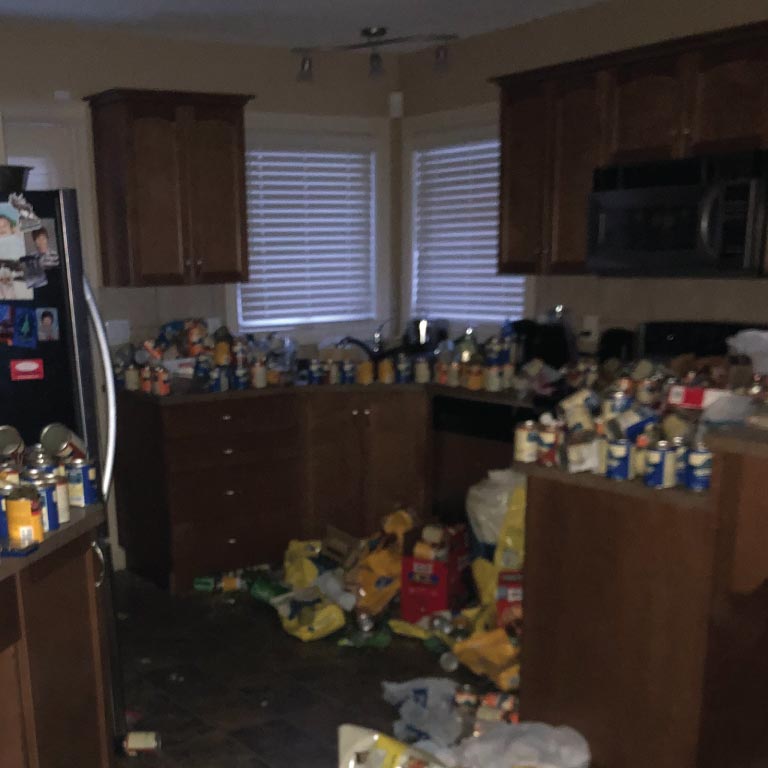
At what (x,y) coordinates should I click in order to perform the action: click on dishwasher. Please return your answer as a coordinate pair (x, y). Looking at the image, I should click on (455, 444).